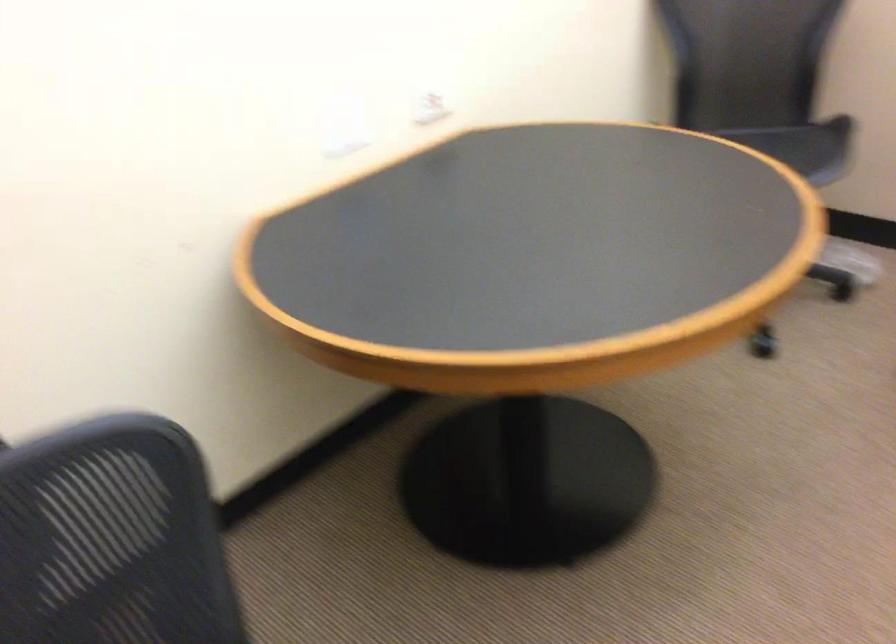
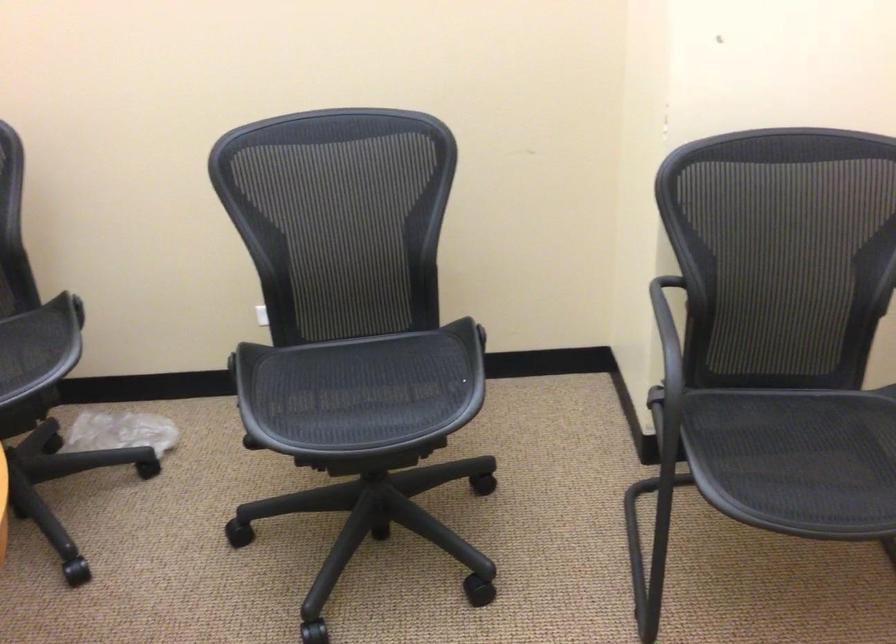
Question: The images are taken continuously from a first-person perspective. In which direction is your viewpoint rotating?

Choices:
 (A) Left
 (B) Right
 (C) Up
 (D) Down

Answer: (B)